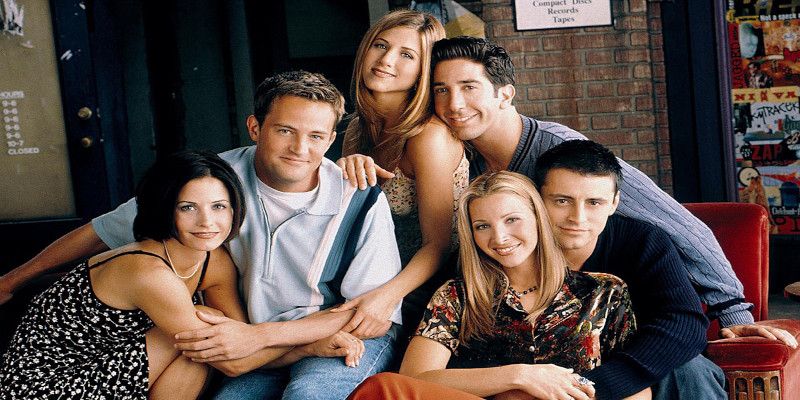
Identify the location of sofa arm. The image size is (800, 400). (753, 349).